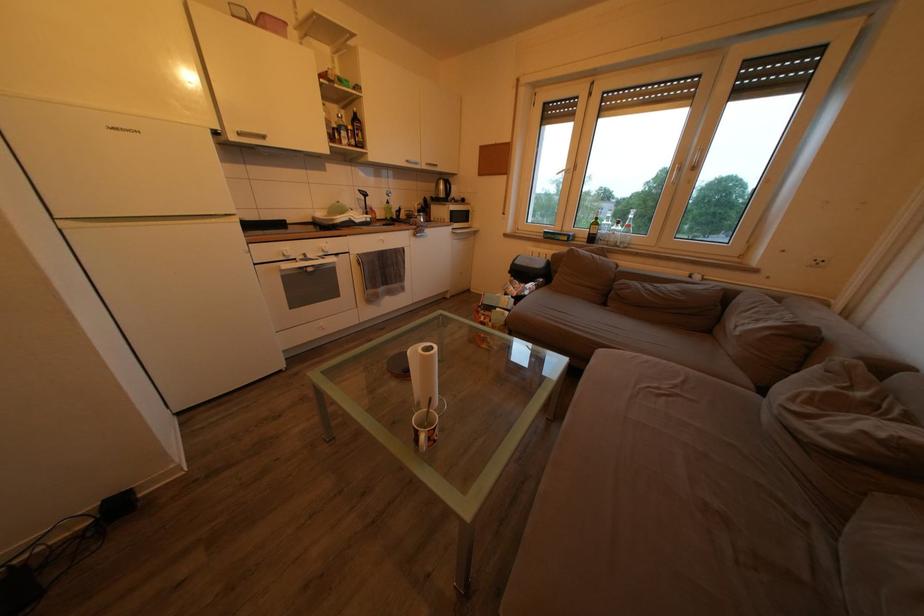
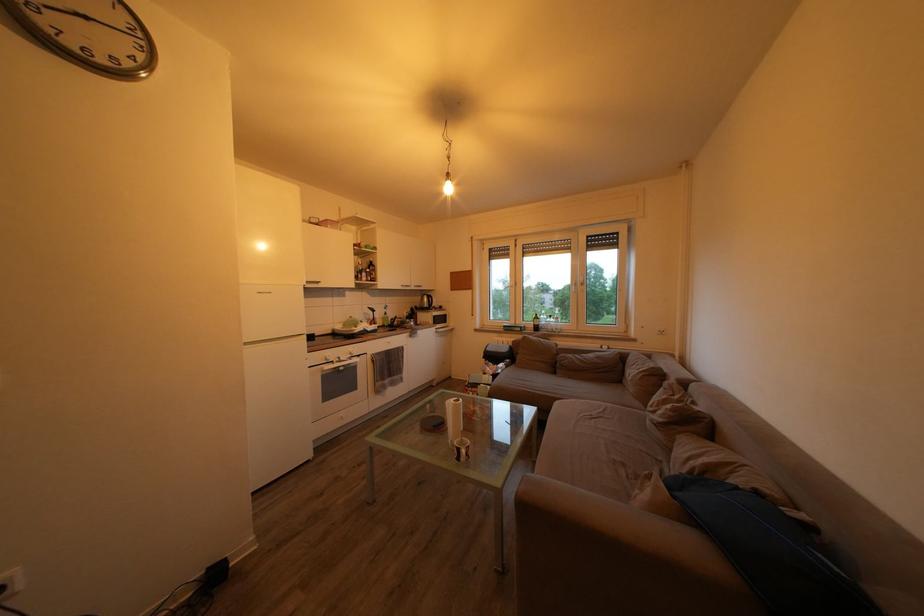
Where in the second image is the point corresponding to [803,415] from the first image?

(659, 416)